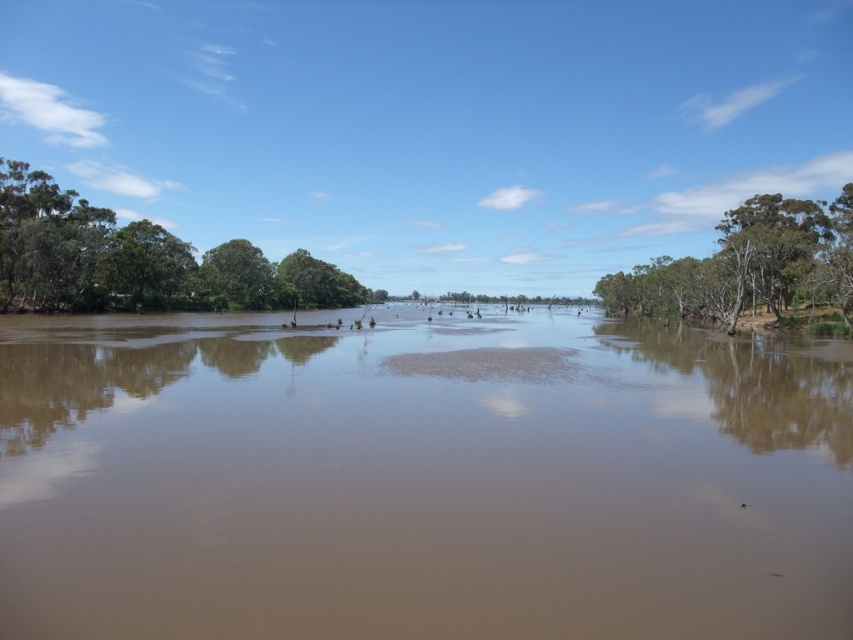
Question: Does brown muddy water at center appear on the left side of green leafy trees at left?

Choices:
 (A) no
 (B) yes

Answer: (A)

Question: Considering the relative positions of brown muddy water at center and green leafy trees at left in the image provided, where is brown muddy water at center located with respect to green leafy trees at left?

Choices:
 (A) right
 (B) left

Answer: (A)

Question: Can you confirm if brown muddy water at center is positioned below green leafy trees at left?

Choices:
 (A) no
 (B) yes

Answer: (B)

Question: Which object appears farthest from the camera in this image?

Choices:
 (A) green leafy tree at right
 (B) brown muddy water at center

Answer: (A)

Question: Which object appears closest to the camera in this image?

Choices:
 (A) green leafy tree at right
 (B) green leafy trees at left

Answer: (A)

Question: Which object is closer to the camera taking this photo?

Choices:
 (A) green leafy trees at left
 (B) green leafy tree at right

Answer: (B)